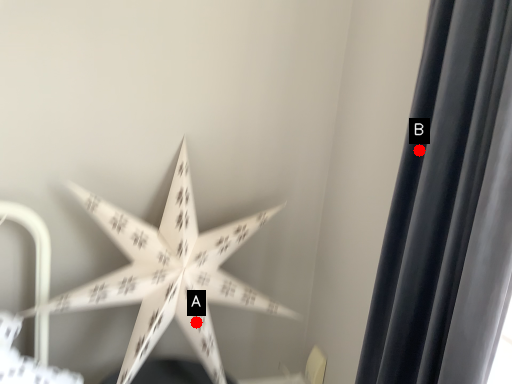
Question: Two points are circled on the image, labeled by A and B beside each circle. Which point is farther to the camera?

Choices:
 (A) A is further
 (B) B is further

Answer: (A)